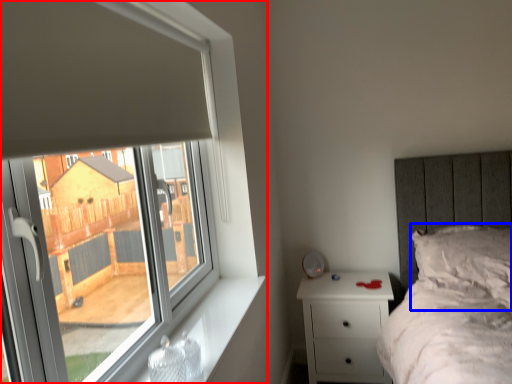
Question: Among these objects, which one is farthest to the camera, window (highlighted by a red box) or pillow (highlighted by a blue box)?

Choices:
 (A) window
 (B) pillow

Answer: (B)